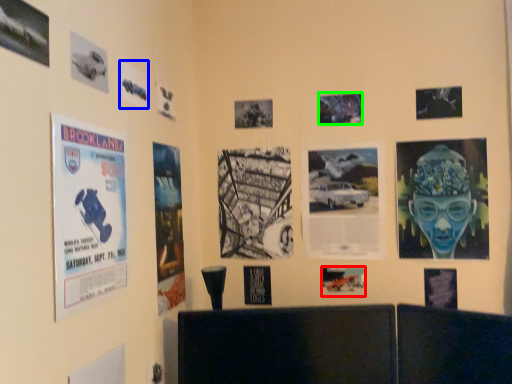
Question: Considering the real-world distances, which object is closest to poster (highlighted by a red box)? poster (highlighted by a blue box) or poster (highlighted by a green box).

Choices:
 (A) poster
 (B) poster

Answer: (B)